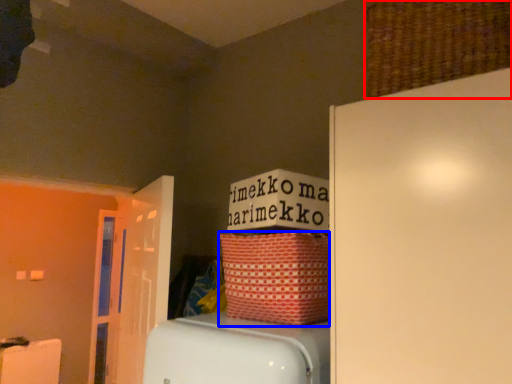
Question: Among these objects, which one is farthest to the camera, basket (highlighted by a red box) or basket (highlighted by a blue box)?

Choices:
 (A) basket
 (B) basket

Answer: (B)